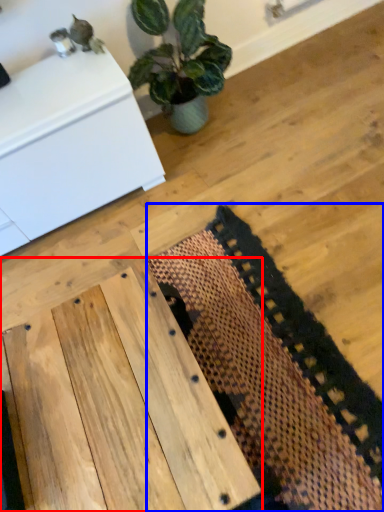
Question: Which of the following is the closest to the observer, table (highlighted by a red box) or mat (highlighted by a blue box)?

Choices:
 (A) table
 (B) mat

Answer: (A)